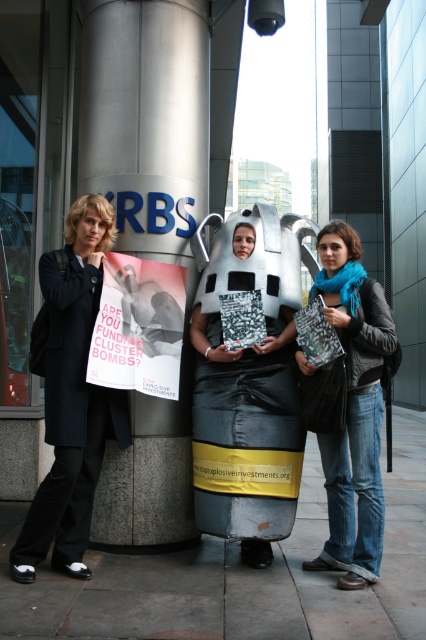
Does brushed metal pillar at center have a lesser height compared to matte black coat at left?

Incorrect, brushed metal pillar at center's height does not fall short of matte black coat at left's.

Who is positioned more to the left, brushed metal pillar at center or matte black coat at left?

Positioned to the left is matte black coat at left.

Between point (207, 26) and point (86, 568), which one is positioned behind?

The point (207, 26) is behind.

The image size is (426, 640). Identify the location of brushed metal pillar at center. (147, 228).

Which is above, matte black coat at left or blue scarf at center?

matte black coat at left

Is matte black coat at left below blue scarf at center?

No.

Between point (80, 461) and point (302, 362), which one is positioned behind?

Point (302, 362)

Where is `matte black coat at left`? The height and width of the screenshot is (640, 426). matte black coat at left is located at coordinates pyautogui.click(x=71, y=397).

Is brushed metal pillar at center below white paper poster at center?

Incorrect, brushed metal pillar at center is not positioned below white paper poster at center.

Is brushed metal pillar at center wider than white paper poster at center?

Correct, the width of brushed metal pillar at center exceeds that of white paper poster at center.

Identify the location of brushed metal pillar at center. Image resolution: width=426 pixels, height=640 pixels. (147, 228).

Image resolution: width=426 pixels, height=640 pixels. I want to click on brushed metal pillar at center, so click(x=147, y=228).